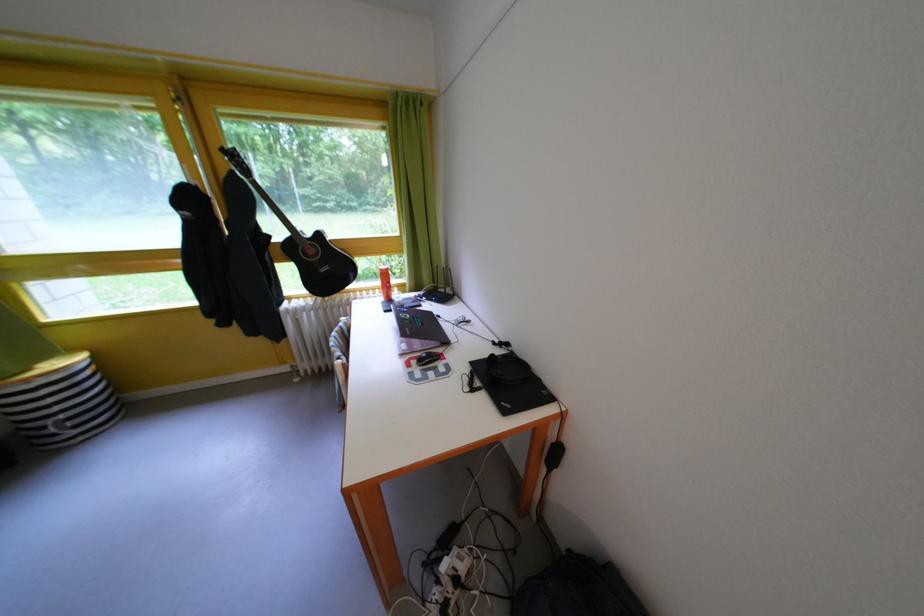
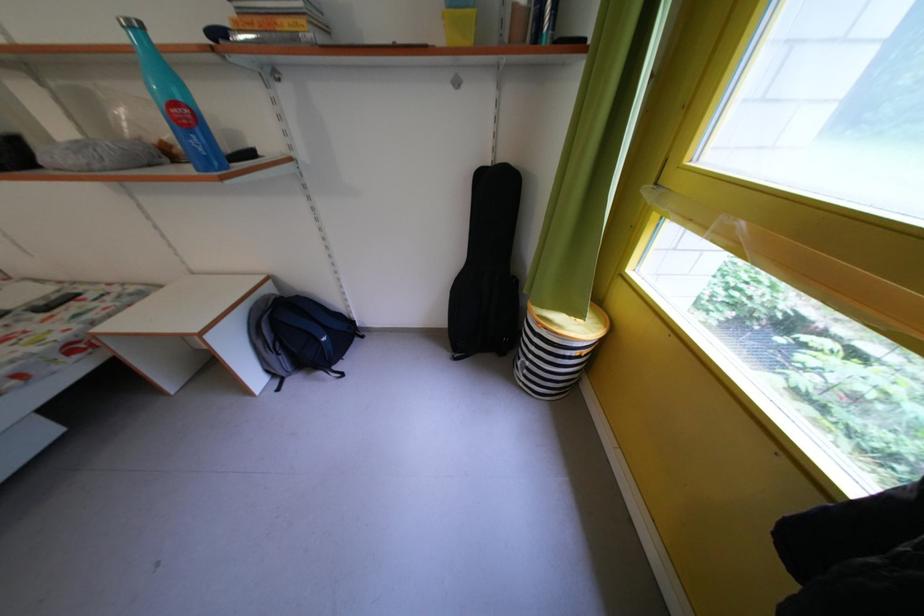
The point at (71, 423) is marked in the first image. Where is the corresponding point in the second image?

(537, 369)